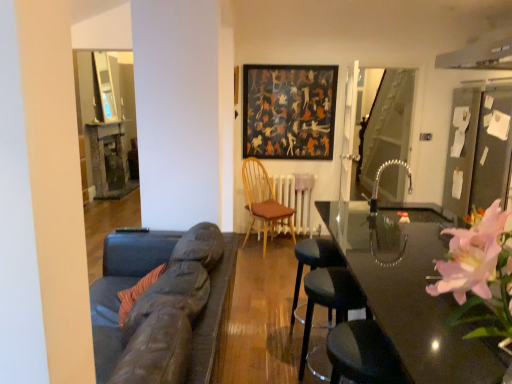
Question: From the image's perspective, would you say glossy black table at center is positioned over black leather stool at lower right, arranged as the 1th chair when viewed from the front?

Choices:
 (A) yes
 (B) no

Answer: (A)

Question: Is glossy black table at center smaller than black leather stool at lower right, which is counted as the second chair, starting from the back?

Choices:
 (A) yes
 (B) no

Answer: (B)

Question: Is glossy black table at center not inside black leather stool at lower right, which is counted as the second chair, starting from the back?

Choices:
 (A) no
 (B) yes

Answer: (B)

Question: Is the position of glossy black table at center less distant than that of black leather stool at lower right, which is counted as the second chair, starting from the back?

Choices:
 (A) yes
 (B) no

Answer: (A)

Question: Would you say glossy black table at center contains black leather stool at lower right, arranged as the 1th chair when viewed from the front?

Choices:
 (A) no
 (B) yes

Answer: (B)

Question: Does glossy black table at center have a larger size compared to black leather stool at lower right, arranged as the 1th chair when viewed from the front?

Choices:
 (A) no
 (B) yes

Answer: (B)

Question: Would you say transparent glass door at right is part of dark gray fabric bar stool at center's contents?

Choices:
 (A) yes
 (B) no

Answer: (B)

Question: Considering the relative positions of dark gray fabric bar stool at center and transparent glass door at right in the image provided, is dark gray fabric bar stool at center to the right of transparent glass door at right from the viewer's perspective?

Choices:
 (A) yes
 (B) no

Answer: (B)

Question: Considering the relative positions of dark gray fabric bar stool at center and transparent glass door at right in the image provided, is dark gray fabric bar stool at center behind transparent glass door at right?

Choices:
 (A) no
 (B) yes

Answer: (A)

Question: Is dark gray fabric bar stool at center to the left of transparent glass door at right from the viewer's perspective?

Choices:
 (A) no
 (B) yes

Answer: (B)

Question: Is dark gray fabric bar stool at center thinner than transparent glass door at right?

Choices:
 (A) yes
 (B) no

Answer: (B)

Question: Is dark gray fabric bar stool at center beside transparent glass door at right?

Choices:
 (A) no
 (B) yes

Answer: (A)

Question: Is glossy black table at center thinner than dark gray fabric bar stool at center?

Choices:
 (A) yes
 (B) no

Answer: (B)